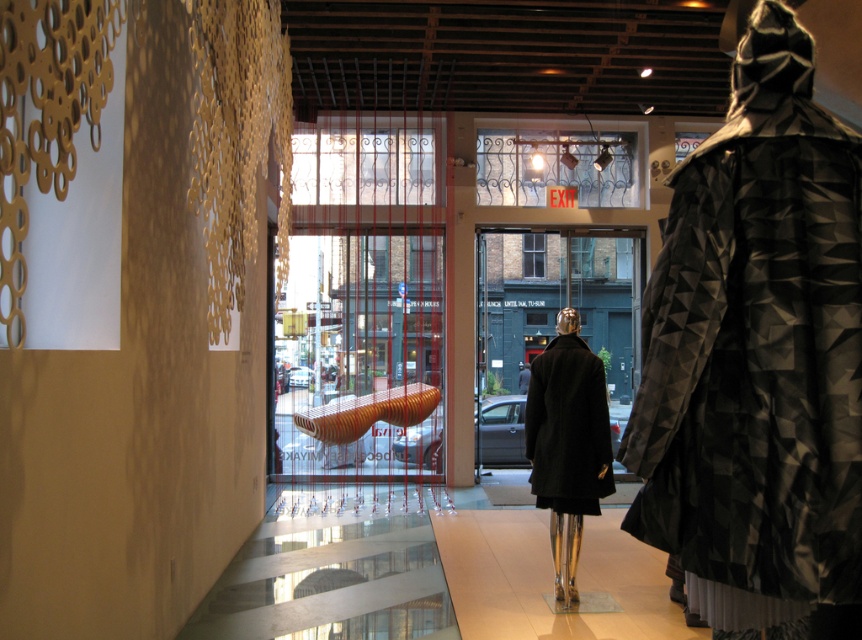
Question: Which point appears closest to the camera in this image?

Choices:
 (A) (564, 397)
 (B) (682, 225)

Answer: (B)

Question: Does geometric-patterned coat at right lie behind black wool coat at center?

Choices:
 (A) yes
 (B) no

Answer: (B)

Question: Which object is closer to the camera taking this photo?

Choices:
 (A) geometric-patterned coat at right
 (B) black wool coat at center

Answer: (A)

Question: Does geometric-patterned coat at right appear on the right side of black wool coat at center?

Choices:
 (A) no
 (B) yes

Answer: (B)

Question: Is geometric-patterned coat at right above black wool coat at center?

Choices:
 (A) no
 (B) yes

Answer: (B)

Question: Which point is farther from the camera taking this photo?

Choices:
 (A) (523, 451)
 (B) (659, 298)

Answer: (A)